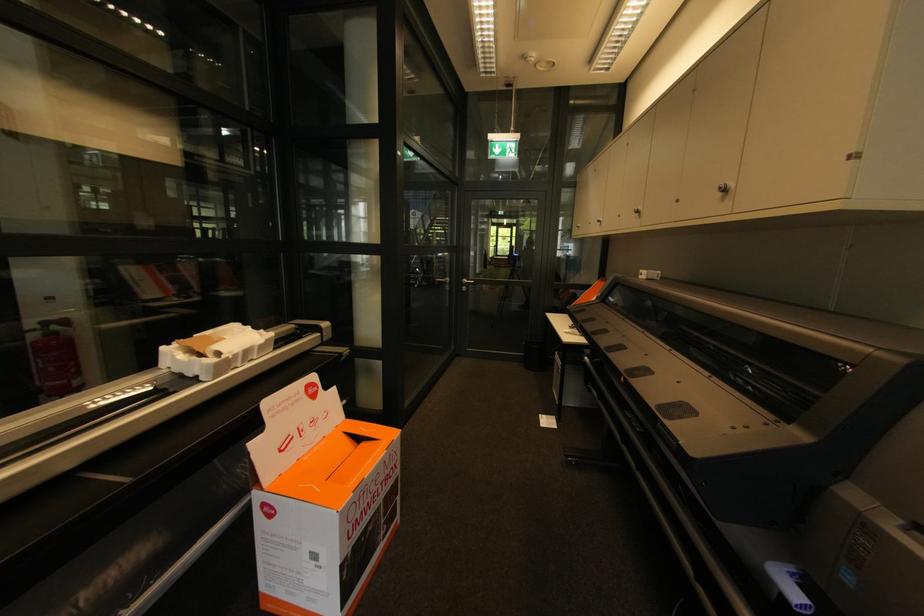
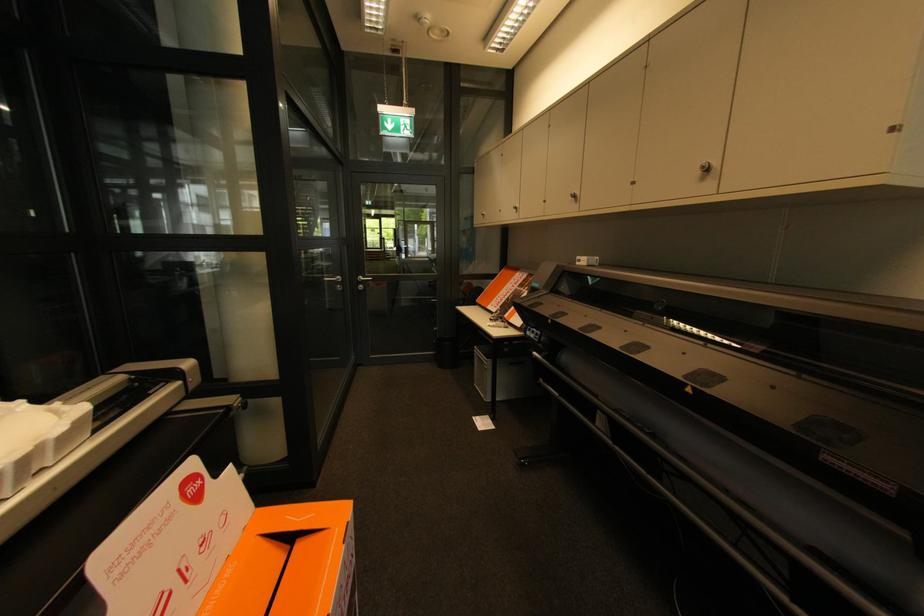
The point at (857, 156) is marked in the first image. Where is the corresponding point in the second image?

(895, 130)